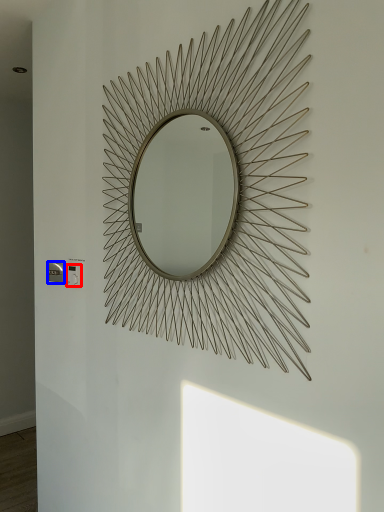
Question: Which object is further to the camera taking this photo, electric outlet (highlighted by a red box) or electric outlet (highlighted by a blue box)?

Choices:
 (A) electric outlet
 (B) electric outlet

Answer: (B)